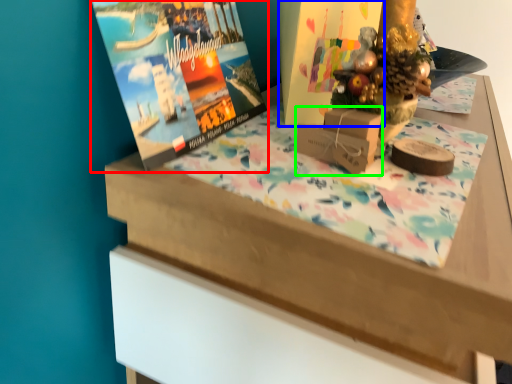
Question: Which object is positioned farthest from magazine (highlighted by a red box)? Select from book cover (highlighted by a blue box) and cardboard box (highlighted by a green box).

Choices:
 (A) book cover
 (B) cardboard box

Answer: (B)